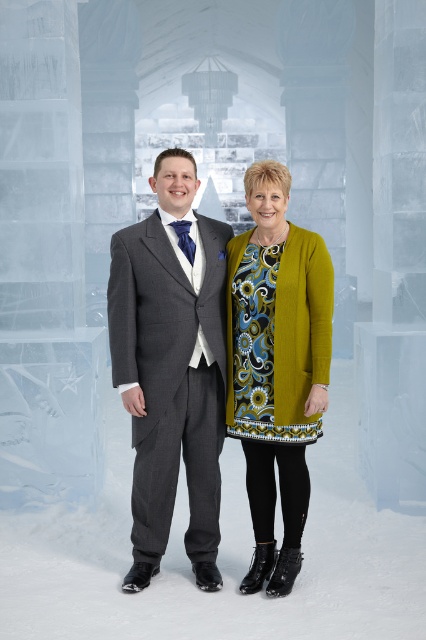
Question: Which point is closer to the camera?

Choices:
 (A) gray pinstripe suit at center
 (B) matte green cardigan at center

Answer: (A)

Question: Where is matte green cardigan at center located in relation to floral print jersey dress at center in the image?

Choices:
 (A) below
 (B) above

Answer: (A)

Question: Can you confirm if gray pinstripe suit at center is smaller than matte green cardigan at center?

Choices:
 (A) no
 (B) yes

Answer: (A)

Question: Does matte green cardigan at center appear over floral print jersey dress at center?

Choices:
 (A) yes
 (B) no

Answer: (B)

Question: Estimate the real-world distances between objects in this image. Which object is farther from the floral print jersey dress at center?

Choices:
 (A) gray pinstripe suit at center
 (B) matte green cardigan at center

Answer: (A)

Question: Which object appears closest to the camera in this image?

Choices:
 (A) gray pinstripe suit at center
 (B) matte green cardigan at center
 (C) floral print jersey dress at center

Answer: (A)